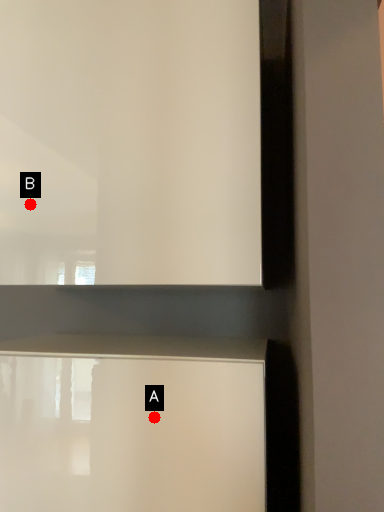
Question: Two points are circled on the image, labeled by A and B beside each circle. Which point is farther from the camera taking this photo?

Choices:
 (A) A is further
 (B) B is further

Answer: (B)